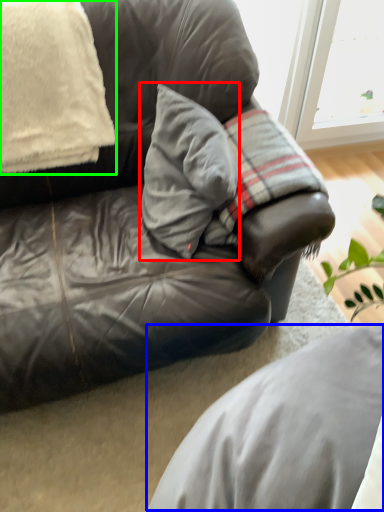
Question: Estimate the real-world distances between objects in this image. Which object is farther from pillow (highlighted by a red box), gray (highlighted by a blue box) or pillow (highlighted by a green box)?

Choices:
 (A) gray
 (B) pillow

Answer: (A)